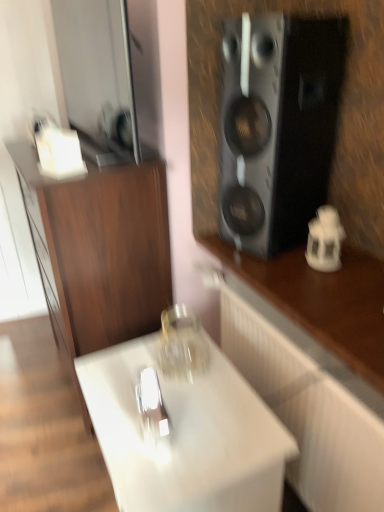
Identify the location of vacant point above white glossy table at center (from a real-world perspective). (178, 399).